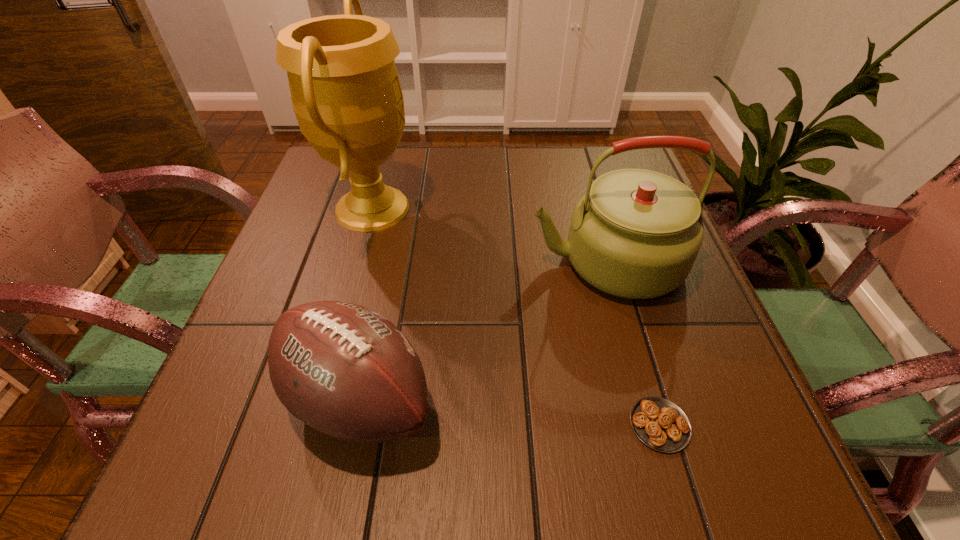
Find the location of a particular element. This screenshot has height=540, width=960. object that is positioned at the far edge is located at coordinates (346, 95).

Find the location of a particular element. The height and width of the screenshot is (540, 960). football (American) present at the near edge is located at coordinates (345, 370).

I want to click on pastry at the near edge, so click(660, 424).

At what (x,y) coordinates should I click in order to perform the action: click on trophy at the left edge. Please return your answer as a coordinate pair (x, y). This screenshot has width=960, height=540. Looking at the image, I should click on (346, 95).

The width and height of the screenshot is (960, 540). I want to click on football (American) located at the left edge, so click(x=345, y=370).

The width and height of the screenshot is (960, 540). What are the coordinates of `kettle located at the right edge` in the screenshot? It's located at (635, 233).

This screenshot has height=540, width=960. I want to click on pastry situated at the right edge, so click(660, 424).

I want to click on object located in the far left corner section of the desktop, so click(346, 95).

Locate an element on the screen. The width and height of the screenshot is (960, 540). object that is at the near left corner is located at coordinates (345, 370).

You are a GUI agent. You are given a task and a screenshot of the screen. Output one action in this format:
    pyautogui.click(x=<x>, y=<y>)
    Task: Click on the object located in the near right corner section of the desktop
    This screenshot has height=540, width=960.
    Given the screenshot: What is the action you would take?
    pyautogui.click(x=660, y=424)